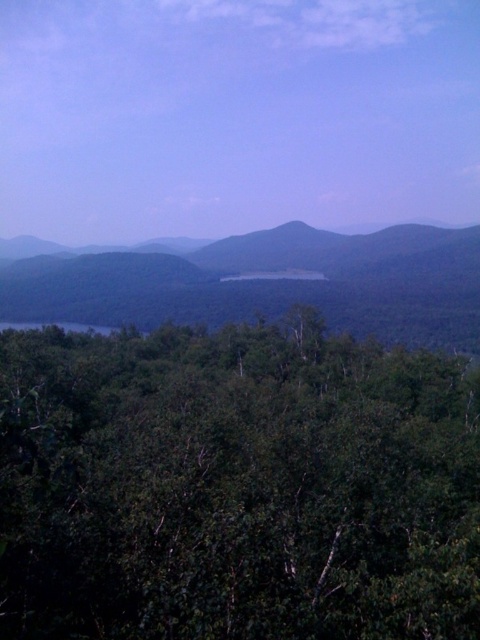
Question: Is green leafy tree at center to the left of green leafy forest at center from the viewer's perspective?

Choices:
 (A) no
 (B) yes

Answer: (A)

Question: Which point is closer to the camera taking this photo?

Choices:
 (A) (279, 252)
 (B) (321, 531)

Answer: (B)

Question: Which object appears farthest from the camera in this image?

Choices:
 (A) green leafy tree at center
 (B) green leafy forest at center

Answer: (B)

Question: Does green leafy tree at center have a greater width compared to green leafy forest at center?

Choices:
 (A) yes
 (B) no

Answer: (B)

Question: Does green leafy tree at center come in front of green leafy forest at center?

Choices:
 (A) no
 (B) yes

Answer: (B)

Question: Which of the following is the farthest from the observer?

Choices:
 (A) green leafy forest at center
 (B) green leafy tree at center

Answer: (A)